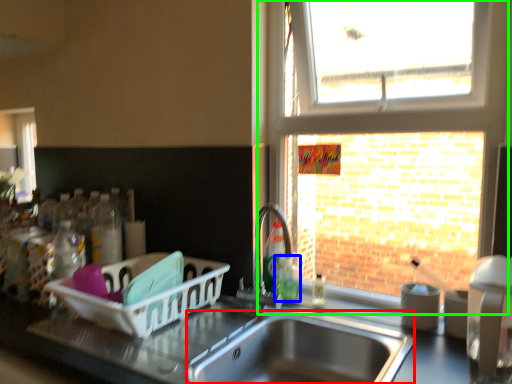
Question: Estimate the real-world distances between objects in this image. Which object is closer to sink (highlighted by a red box), bottle (highlighted by a blue box) or window (highlighted by a green box)?

Choices:
 (A) bottle
 (B) window

Answer: (A)